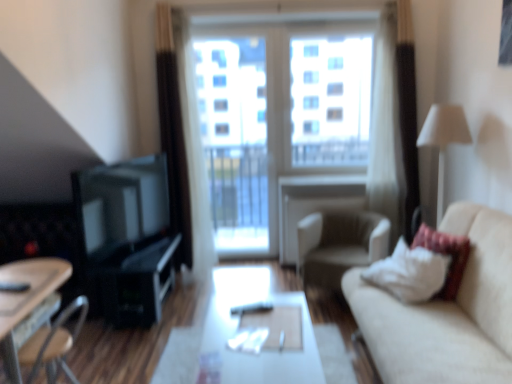
In order to click on free space in front of white sheer curtain at left in this screenshot , I will do `click(186, 280)`.